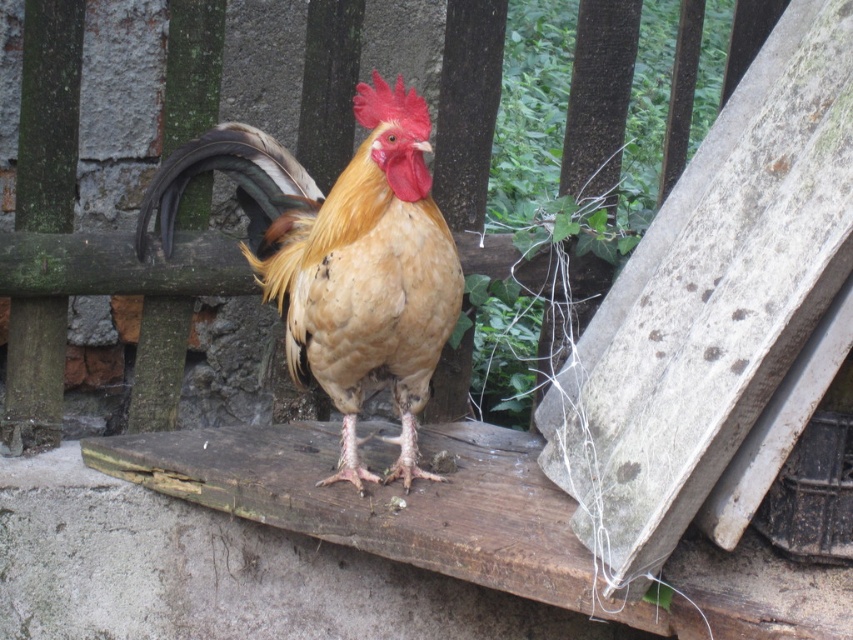
You are a farmer checking the coop and see the golden feathered rooster at center and the wooden at center. Which object is wider?

The wooden at center is wider than the golden feathered rooster at center.

You are standing in a rural area and see the golden feathered rooster at center. If you want to approach it, which direction should you move relative to the wooden fence behind it?

The golden feathered rooster at center is located at point (341, 259), which means it is positioned slightly to the right and forward from the wooden fence. To approach it, you should move towards the center area in front of the fence where the rooster is standing.